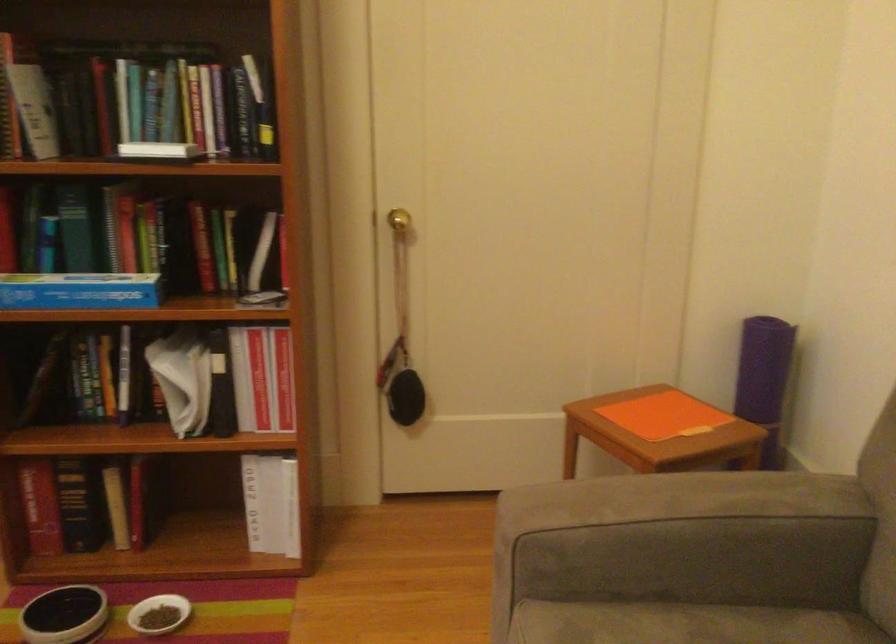
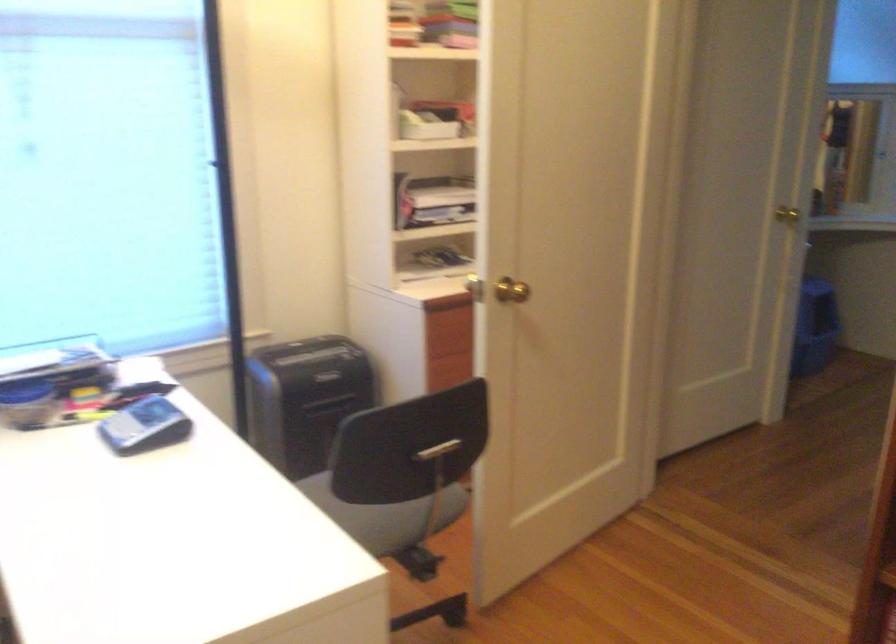
Question: How did the camera likely rotate?

Choices:
 (A) Left
 (B) Right
 (C) Up
 (D) Down

Answer: (A)